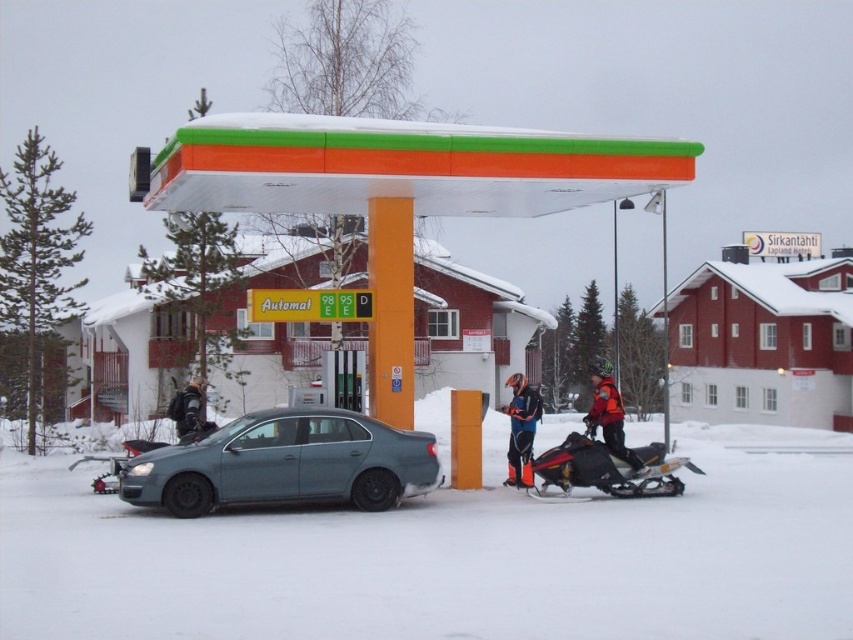
Question: Is the position of black matte snowmobile at lower right less distant than that of orange ski suit at center?

Choices:
 (A) no
 (B) yes

Answer: (B)

Question: Which object appears farthest from the camera in this image?

Choices:
 (A) black matte snowmobile at lower right
 (B) orange ski suit at center
 (C) slate gray matte sedan at center
 (D) black matte snowmobile at lower left

Answer: (D)

Question: Considering the real-world distances, which object is closest to the orange reflective jacket at center?

Choices:
 (A) black matte snowmobile at lower right
 (B) orange matte gas station canopy at center
 (C) orange ski suit at center

Answer: (A)

Question: Does slate gray matte sedan at center appear on the right side of orange ski suit at center?

Choices:
 (A) no
 (B) yes

Answer: (A)

Question: Considering the real-world distances, which object is farthest from the slate gray matte sedan at center?

Choices:
 (A) white powdery snow at center
 (B) black matte snowmobile at lower left
 (C) orange reflective jacket at center
 (D) orange ski suit at center

Answer: (C)

Question: Where is black matte snowmobile at lower right located in relation to orange reflective jacket at center in the image?

Choices:
 (A) right
 (B) left

Answer: (B)